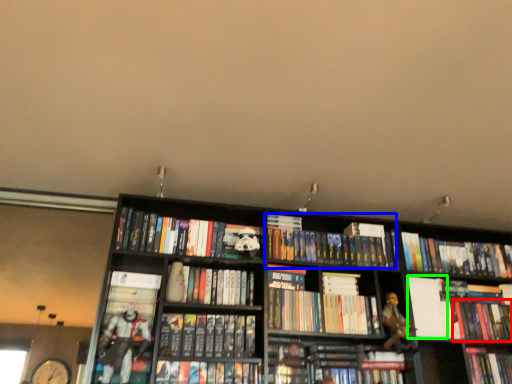
Question: Which object is the farthest from book (highlighted by a red box)? Choose among these: book (highlighted by a blue box) or paperback book (highlighted by a green box).

Choices:
 (A) book
 (B) paperback book

Answer: (A)